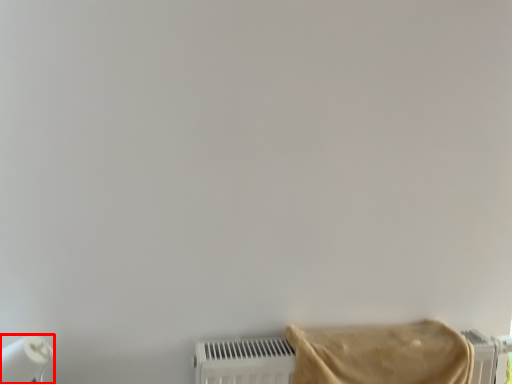
Question: From the image's perspective, where is paper towel (annotated by the red box) located relative to towel?

Choices:
 (A) below
 (B) above

Answer: (A)